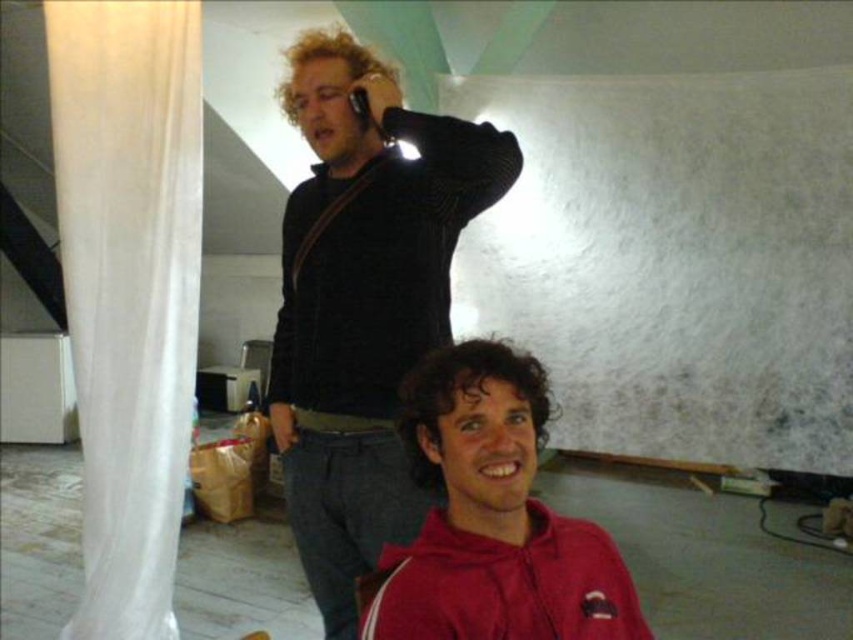
You are an interior designer assessing the space. You need to determine if the black sweater at upper center can be placed on a shelf that can hold items up to the width of the white sheer curtain at left. Based on the description, can the sweater fit on the shelf?

The black sweater at upper center has a width larger than the white sheer curtain at left, so it cannot fit on the shelf designed for the curtain.